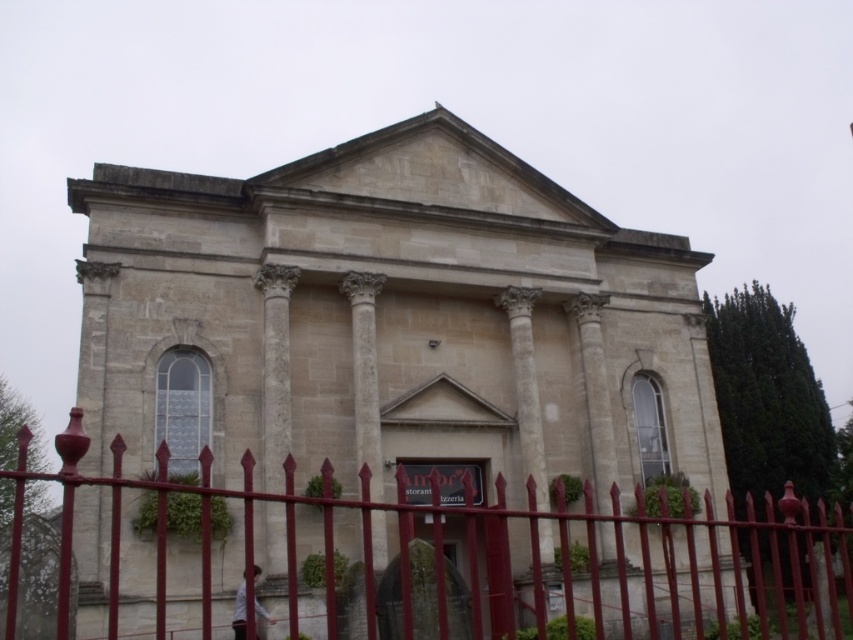
Does beige stone church at center appear on the left side of white stone column at center?

No, beige stone church at center is not to the left of white stone column at center.

Can you confirm if beige stone church at center is thinner than white stone column at center?

No.

Which is in front, point (339, 381) or point (379, 483)?

Positioned in front is point (379, 483).

The height and width of the screenshot is (640, 853). I want to click on beige stone church at center, so click(392, 323).

Identify the location of smooth metal fence at center. Image resolution: width=853 pixels, height=640 pixels. (671, 561).

What are the coordinates of `smooth metal fence at center` in the screenshot? It's located at (671, 561).

You are a GUI agent. You are given a task and a screenshot of the screen. Output one action in this format:
    pyautogui.click(x=<x>, y=<y>)
    Task: Click on the smooth metal fence at center
    
    Given the screenshot: What is the action you would take?
    pyautogui.click(x=671, y=561)

Is point (708, 392) closer to camera compared to point (650, 637)?

No, (708, 392) is behind (650, 637).

Is beige stone church at center thinner than smooth metal fence at center?

Correct, beige stone church at center's width is less than smooth metal fence at center's.

This screenshot has width=853, height=640. Describe the element at coordinates (392, 323) in the screenshot. I see `beige stone church at center` at that location.

Identify the location of beige stone church at center. The height and width of the screenshot is (640, 853). (392, 323).